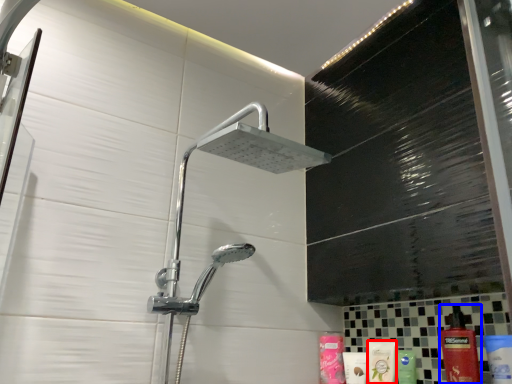
Question: Which object is closer to the camera taking this photo, mouthwash (highlighted by a red box) or cleaning product (highlighted by a blue box)?

Choices:
 (A) mouthwash
 (B) cleaning product

Answer: (B)